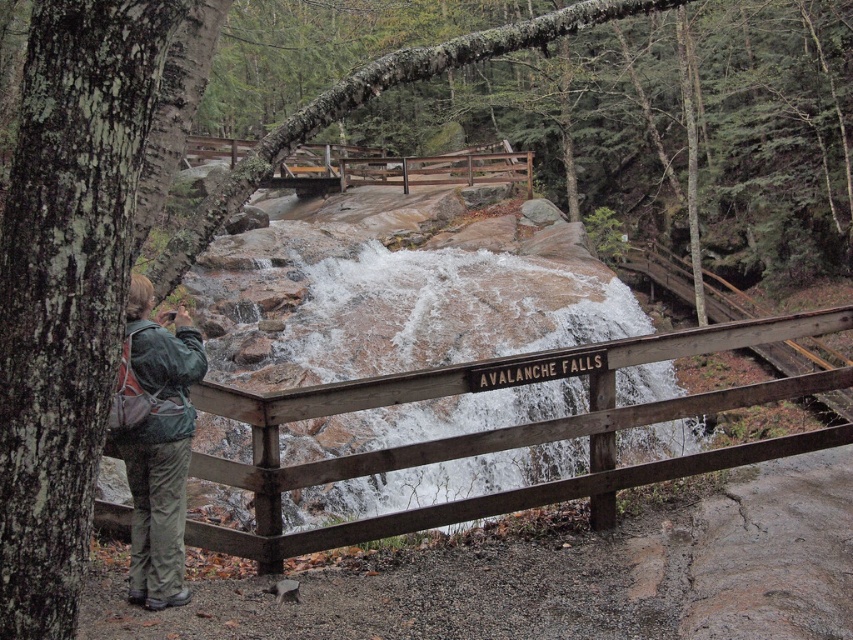
Question: Which of the following is the closest to the observer?

Choices:
 (A) green fabric jacket at lower left
 (B) wooden bridge at center
 (C) wooden fence at center

Answer: (A)

Question: Which of the following is the farthest from the observer?

Choices:
 (A) wooden bridge at center
 (B) green fabric jacket at lower left
 (C) wooden fence at center

Answer: (C)

Question: Does green fabric jacket at lower left appear under wooden bridge at center?

Choices:
 (A) no
 (B) yes

Answer: (B)

Question: Is green fabric jacket at lower left closer to the viewer compared to wooden bridge at center?

Choices:
 (A) no
 (B) yes

Answer: (B)

Question: Which object is closer to the camera taking this photo?

Choices:
 (A) wooden fence at center
 (B) green fabric jacket at lower left

Answer: (B)

Question: Where is wooden fence at center located in relation to wooden bridge at center in the image?

Choices:
 (A) left
 (B) right

Answer: (B)